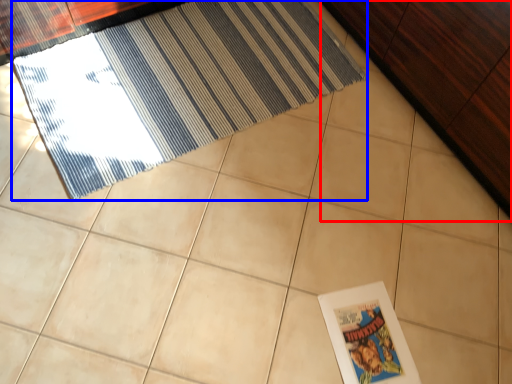
Question: Which object is further to the camera taking this photo, dresser (highlighted by a red box) or door (highlighted by a blue box)?

Choices:
 (A) dresser
 (B) door

Answer: (B)